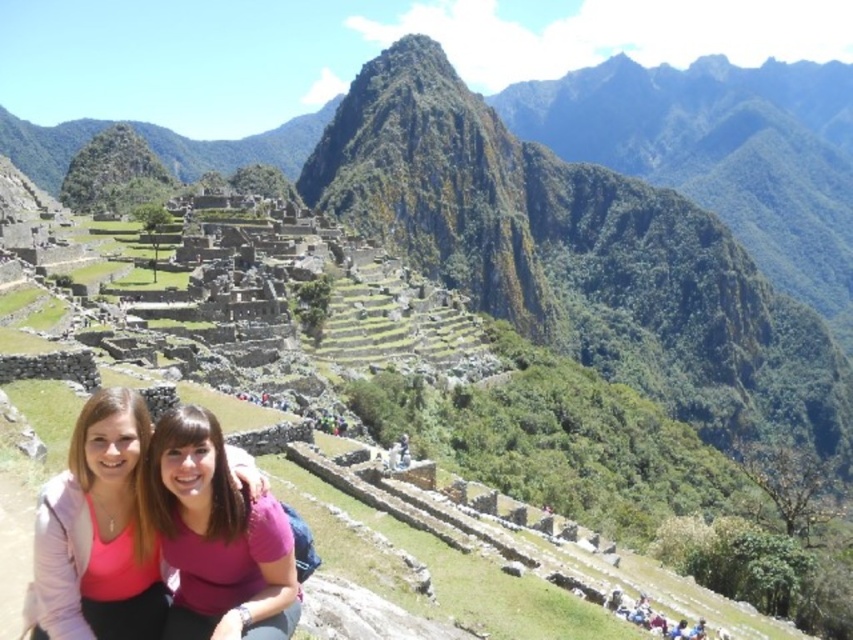
You are a photographer at Machu Picchu and want to capture a photo of the pink fabric at center and the pink matte shirt at center. Which one should you focus on first to ensure both are in focus?

The pink fabric at center is closer to the viewer than the pink matte shirt at center, so focus on the pink fabric at center first to ensure both are in focus.

You are standing at the viewpoint of the image and want to reach the point marked as point (122, 406). If your walking speed is 1.5 meters per second, how long will it take you to reach that point?

The distance of point (122, 406) from viewer is 21.00 meters. At a speed of 1.5 meters per second, it will take 14 seconds to reach the point.

You are a photographer at Machu Picchu and want to capture a photo of the two tourists. You notice the pink fabric at center and the pink matte shirt at center in the scene. Which object should you focus on if you want to highlight something narrower in the photo?

The pink fabric at center has a lesser width compared to the pink matte shirt at center, so focusing on the pink fabric at center would highlight the narrower object.